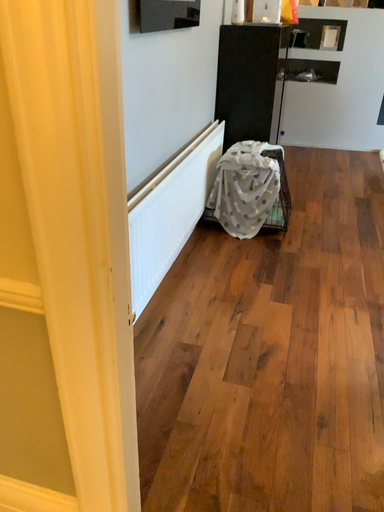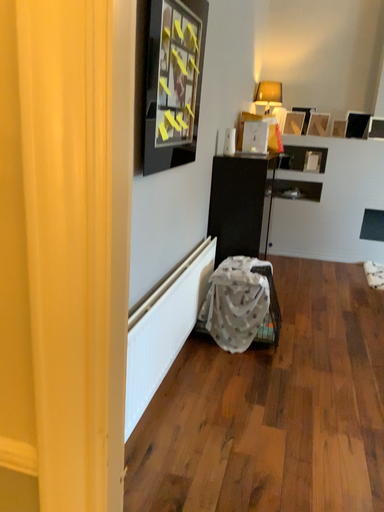
Question: How did the camera likely rotate when shooting the video?

Choices:
 (A) rotated downward
 (B) rotated upward

Answer: (B)